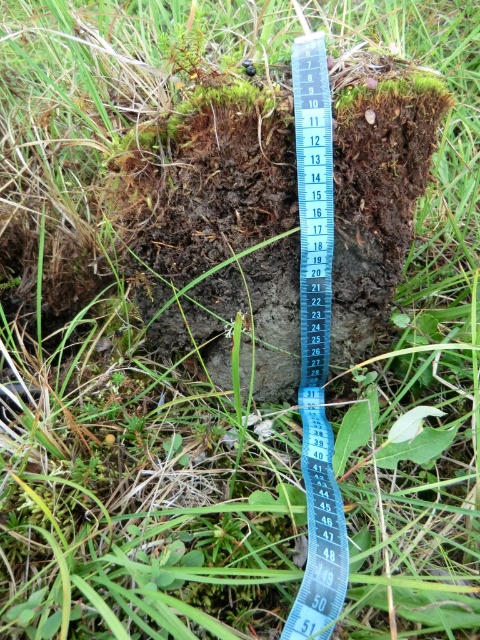
You are a geologist examining the soil core sample. You notice the brown soil at center and the blue plastic tape measure at center. Which object is positioned to the right side of the other?

The brown soil at center is to the left of blue plastic tape measure at center, so the blue plastic tape measure at center is positioned to the right of the brown soil at center.